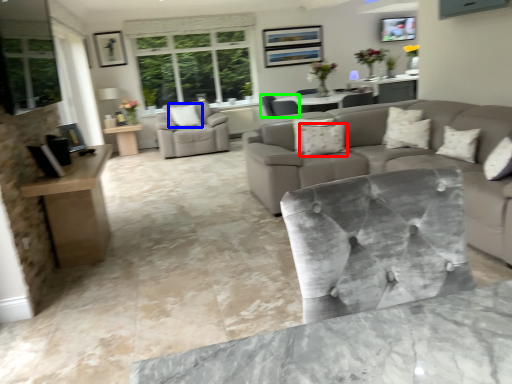
Question: Based on their relative distances, which object is farther from pillow (highlighted by a red box)? Choose from pillow (highlighted by a blue box) and chair (highlighted by a green box).

Choices:
 (A) pillow
 (B) chair

Answer: (A)